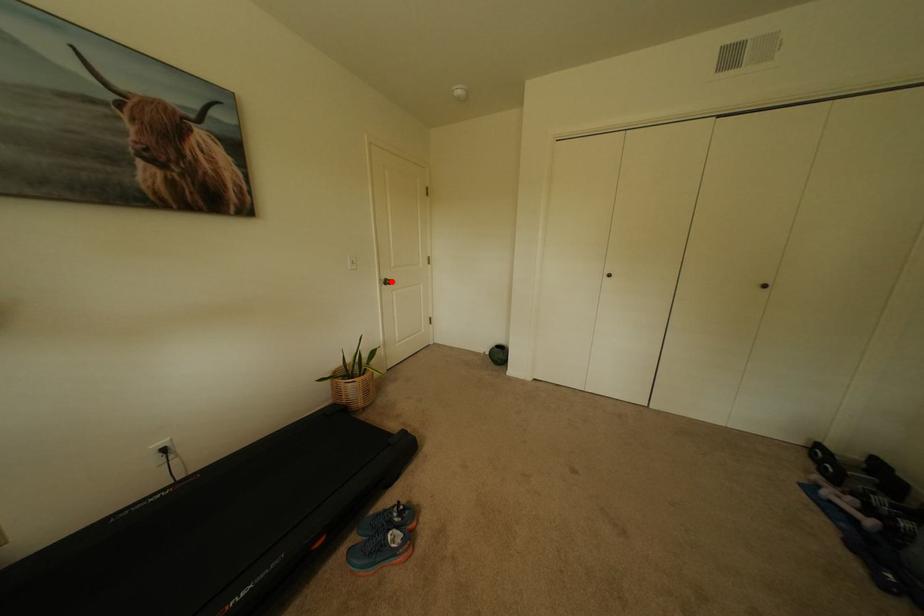
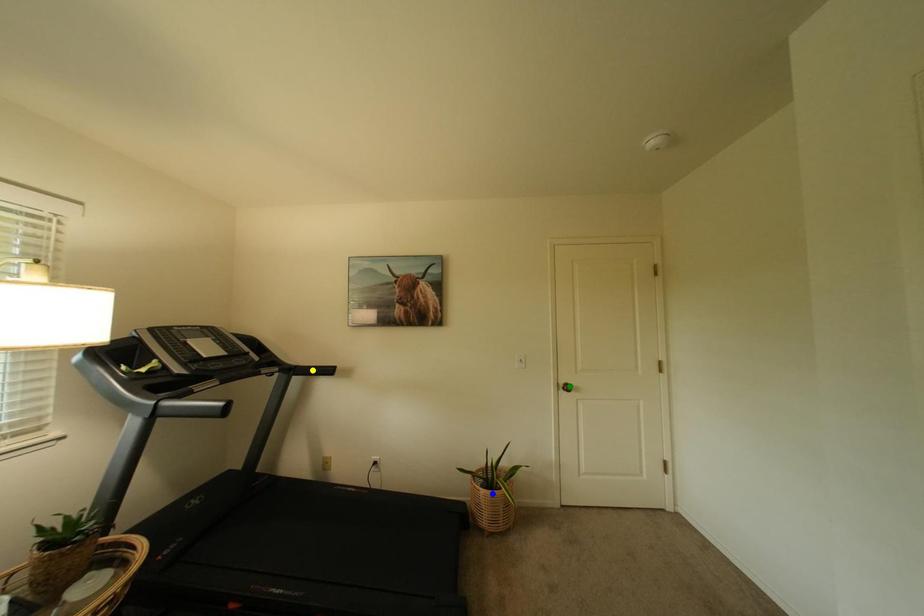
Question: I am providing you with two images of the same scene from different viewpoints. A red point is marked on the first image. You are given multiple points on the second image. Can you choose the point in image 2 that corresponds to the point in image 1?

Choices:
 (A) green point
 (B) yellow point
 (C) blue point

Answer: (A)